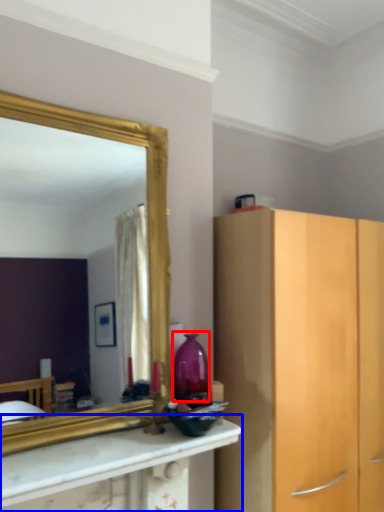
Question: Which object is closer to the camera taking this photo, vase (highlighted by a red box) or countertop (highlighted by a blue box)?

Choices:
 (A) vase
 (B) countertop

Answer: (B)